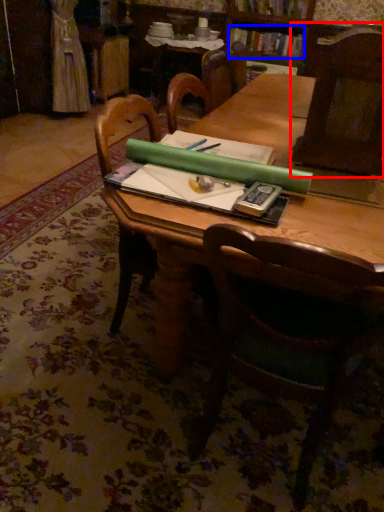
Question: Which point is further to the camera, chair (highlighted by a red box) or book (highlighted by a blue box)?

Choices:
 (A) chair
 (B) book

Answer: (B)